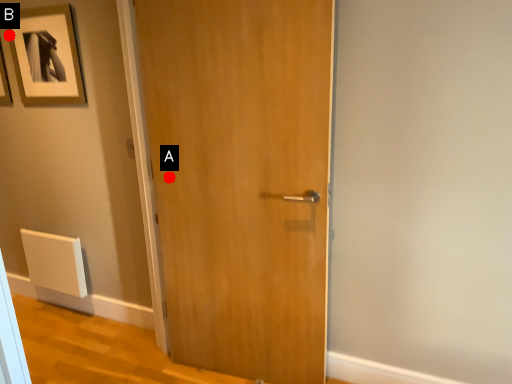
Question: Two points are circled on the image, labeled by A and B beside each circle. Which point is closer to the camera?

Choices:
 (A) A is closer
 (B) B is closer

Answer: (A)